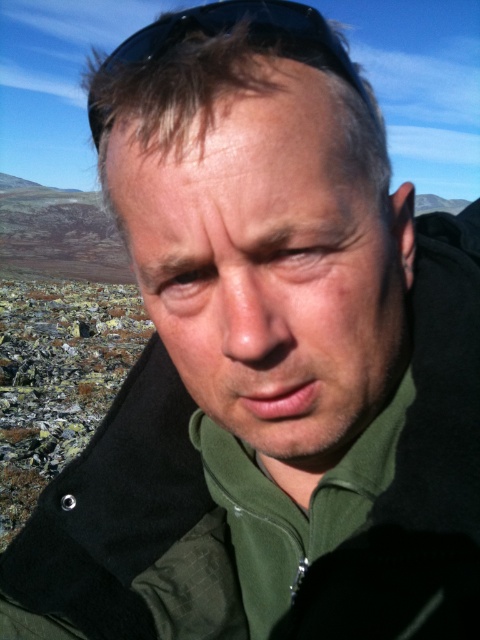
Question: Which object appears farthest from the camera in this image?

Choices:
 (A) black matte sunglasses at upper center
 (B) smooth skin nose at center
 (C) matte green jacket at center

Answer: (A)

Question: Estimate the real-world distances between objects in this image. Which object is farther from the black matte sunglasses at upper center?

Choices:
 (A) smooth skin nose at center
 (B) matte green jacket at center

Answer: (A)

Question: From the image, what is the correct spatial relationship of smooth skin nose at center in relation to black matte sunglasses at upper center?

Choices:
 (A) left
 (B) right

Answer: (B)

Question: Can you confirm if matte green jacket at center is bigger than black matte sunglasses at upper center?

Choices:
 (A) no
 (B) yes

Answer: (B)

Question: Which of the following is the closest to the observer?

Choices:
 (A) smooth skin nose at center
 (B) matte green jacket at center

Answer: (B)

Question: Is the position of smooth skin nose at center more distant than that of black matte sunglasses at upper center?

Choices:
 (A) yes
 (B) no

Answer: (B)